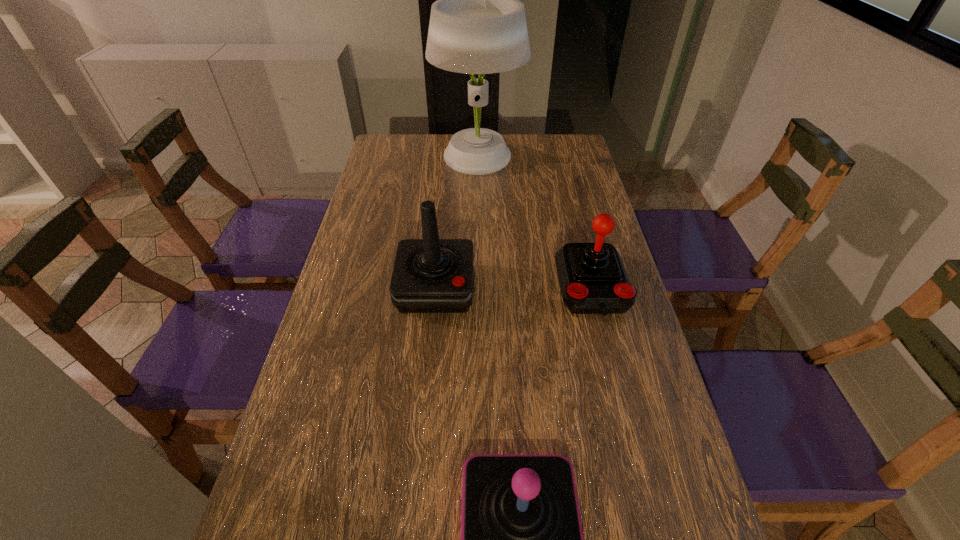
Locate an element on the screen. the farthest object is located at coordinates (477, 25).

Where is `lamp`? lamp is located at coordinates (477, 25).

The width and height of the screenshot is (960, 540). Find the location of `the second tallest object`. the second tallest object is located at coordinates (430, 275).

This screenshot has width=960, height=540. Identify the location of the rightmost object. (593, 280).

You are a GUI agent. You are given a task and a screenshot of the screen. Output one action in this format:
    pyautogui.click(x=<x>, y=<y>)
    Task: Click on the second shortest joystick
    
    Given the screenshot: What is the action you would take?
    pyautogui.click(x=593, y=280)

The image size is (960, 540). Identify the location of vacant area situated 0.140m on the front-facing side of the tallest object. (560, 159).

Where is `free spot located 0.110m on the front-facing side of the tallest joystick`? The height and width of the screenshot is (540, 960). free spot located 0.110m on the front-facing side of the tallest joystick is located at coordinates (429, 352).

Locate an element on the screen. The image size is (960, 540). vacant space situated 0.300m on the base of the second shortest joystick is located at coordinates (630, 440).

Image resolution: width=960 pixels, height=540 pixels. Identify the location of object that is at the far edge. (477, 25).

Find the location of a particular element. This screenshot has height=540, width=960. object at the right edge is located at coordinates (593, 280).